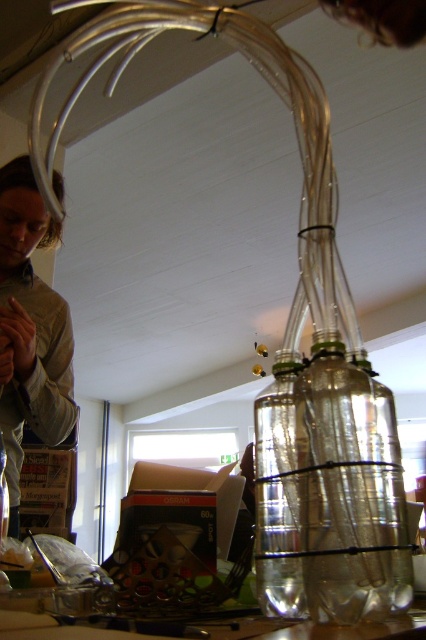
You are standing in the workshop and want to reach the point marked as point (313, 403). Can you estimate how far you need to move to get there?

The point (313, 403) is 27.53 inches away from you, so you need to move approximately 27.53 inches to reach it.

You are an interior designer planning to place a new piece of furniture in the workshop. The furniture requires a clear space of at least 1 meter in front of it. Based on the location of the transparent plastic bottles at center, is the area around them suitable for this requirement?

The transparent plastic bottles at center are located at coordinates point (350, 490). Without specific spatial dimensions, it is unclear if there is sufficient space around them to meet the 1 meter requirement. Further measurements would be needed to determine suitability.

You are an artist working in this workshop and want to place a new sculpture on the table. The sculpture requires a stable base. Which object on the table, matte brown hair at upper left or clear glass bottle at center, would be more suitable as a base?

The matte brown hair at upper left is above the clear glass bottle at center, so the clear glass bottle at center is lower and likely more stable for the sculpture base.